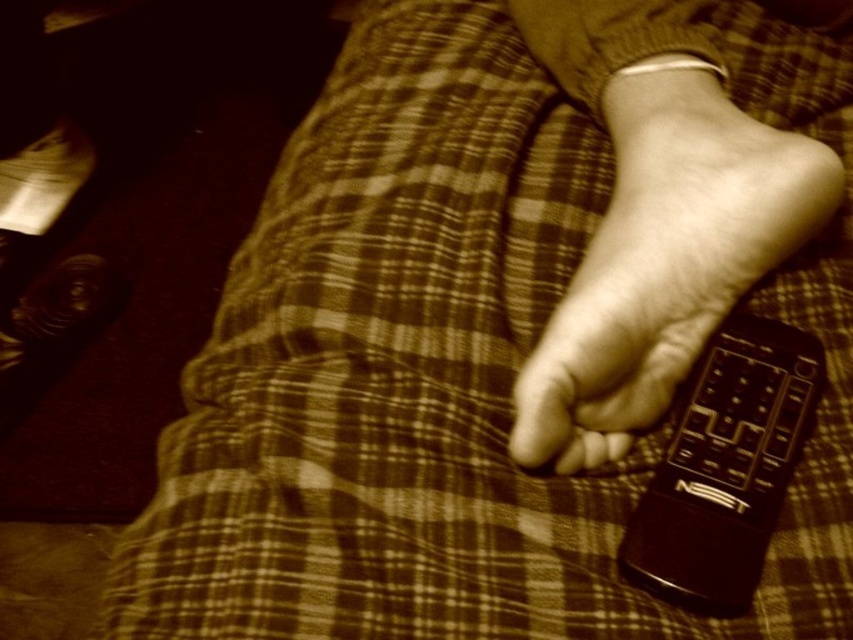
You are trying to decide which remote to use. The matte black remote at lower right and the black plastic remote at lower right are both in your view. Which one is wider?

The matte black remote at lower right might be wider than the black plastic remote at lower right.

You are trying to locate the matte black remote at lower right in the image. Can you describe its exact location using coordinates?

The matte black remote at lower right is located at coordinates point [664,268].